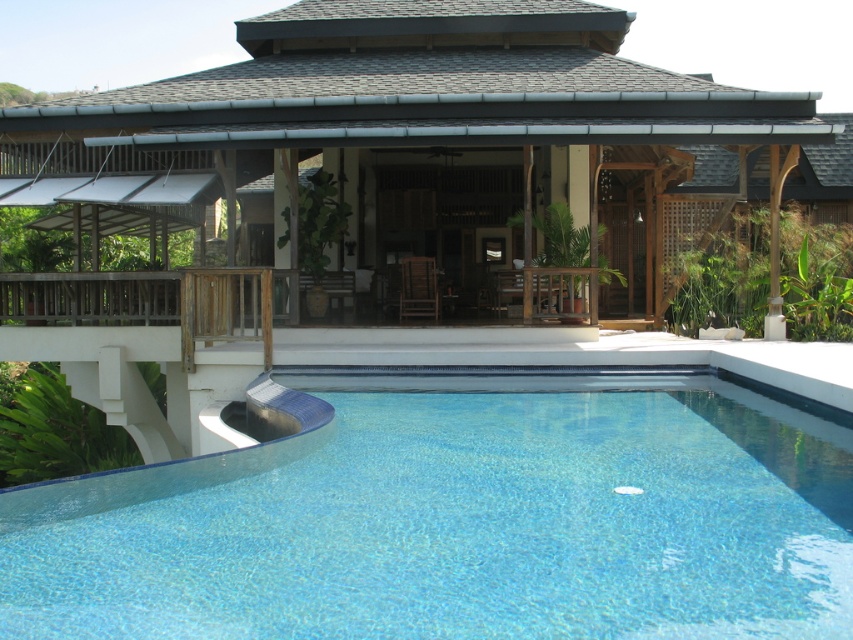
Does blue tile pool at lower center lie in front of clear glass pool at center?

No, it is not.

Does blue tile pool at lower center have a larger size compared to clear glass pool at center?

Yes.

Locate an element on the screen. blue tile pool at lower center is located at coordinates (376, 189).